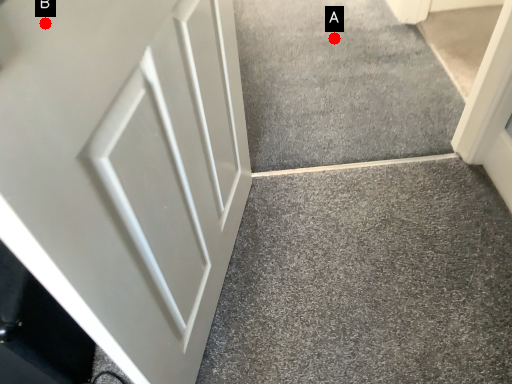
Question: Two points are circled on the image, labeled by A and B beside each circle. Which point is further to the camera?

Choices:
 (A) A is further
 (B) B is further

Answer: (A)